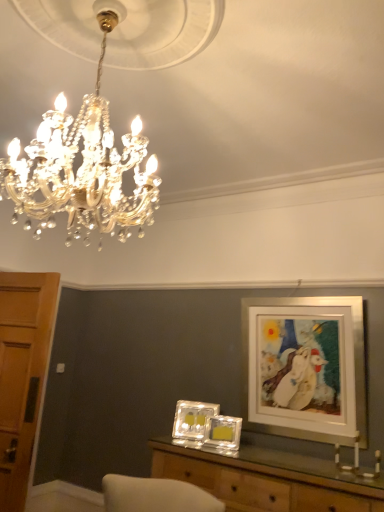
Question: Is wooden table at center behind wooden door at left?

Choices:
 (A) yes
 (B) no

Answer: (B)

Question: Could you tell me if wooden table at center is facing wooden door at left?

Choices:
 (A) yes
 (B) no

Answer: (B)

Question: From the image's perspective, would you say wooden table at center is positioned over wooden door at left?

Choices:
 (A) yes
 (B) no

Answer: (B)

Question: Would you say wooden table at center is a long distance from wooden door at left?

Choices:
 (A) no
 (B) yes

Answer: (B)

Question: From a real-world perspective, is wooden table at center below wooden door at left?

Choices:
 (A) no
 (B) yes

Answer: (B)

Question: Considering their positions, is translucent glass picture frame at center, the 2th picture frame viewed from the left, located in front of or behind gold crystal chandelier at upper center?

Choices:
 (A) front
 (B) behind

Answer: (B)

Question: From the image's perspective, relative to gold crystal chandelier at upper center, is translucent glass picture frame at center, the 2th picture frame viewed from the left, above or below?

Choices:
 (A) below
 (B) above

Answer: (A)

Question: Visually, is translucent glass picture frame at center, the 2th picture frame viewed from the left, positioned to the left or to the right of gold crystal chandelier at upper center?

Choices:
 (A) right
 (B) left

Answer: (A)

Question: From a real-world perspective, is translucent glass picture frame at center, which appears as the 2th picture frame when viewed from the right, physically located above or below gold crystal chandelier at upper center?

Choices:
 (A) above
 (B) below

Answer: (B)

Question: Is wooden table at center in front of or behind white matte picture frame at upper right, the 3th picture frame viewed from the left, in the image?

Choices:
 (A) front
 (B) behind

Answer: (A)

Question: From a real-world perspective, relative to white matte picture frame at upper right, the first picture frame from the right, is wooden table at center vertically above or below?

Choices:
 (A) below
 (B) above

Answer: (A)

Question: Does point (258, 506) appear closer or farther from the camera than point (258, 346)?

Choices:
 (A) closer
 (B) farther

Answer: (A)

Question: Would you say wooden table at center is to the left or to the right of white matte picture frame at upper right, the first picture frame from the right, in the picture?

Choices:
 (A) right
 (B) left

Answer: (B)

Question: From the image's perspective, is gold crystal chandelier at upper center located above or below wooden door at left?

Choices:
 (A) below
 (B) above

Answer: (B)

Question: From their relative heights in the image, would you say gold crystal chandelier at upper center is taller or shorter than wooden door at left?

Choices:
 (A) tall
 (B) short

Answer: (B)